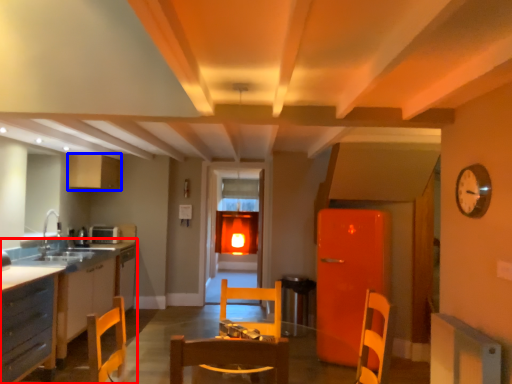
Question: Which of the following is the closest to the observer, countertop (highlighted by a red box) or cabinetry (highlighted by a blue box)?

Choices:
 (A) countertop
 (B) cabinetry

Answer: (A)